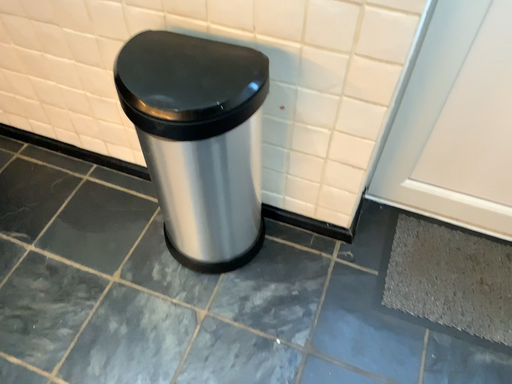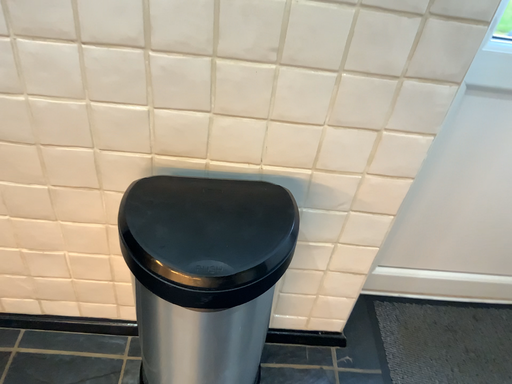
Question: Which way did the camera rotate in the video?

Choices:
 (A) rotated upward
 (B) rotated downward

Answer: (A)